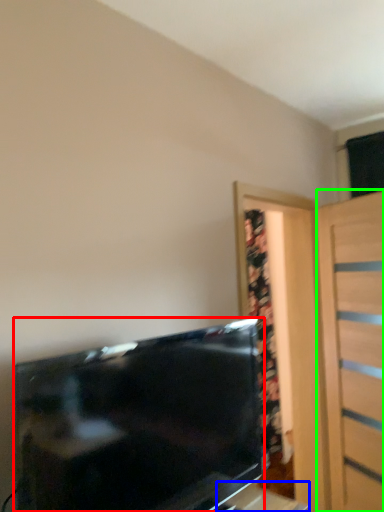
Question: Which object is the farthest from television (highlighted by a red box)? Choose among these: table (highlighted by a blue box) or door (highlighted by a green box).

Choices:
 (A) table
 (B) door

Answer: (A)